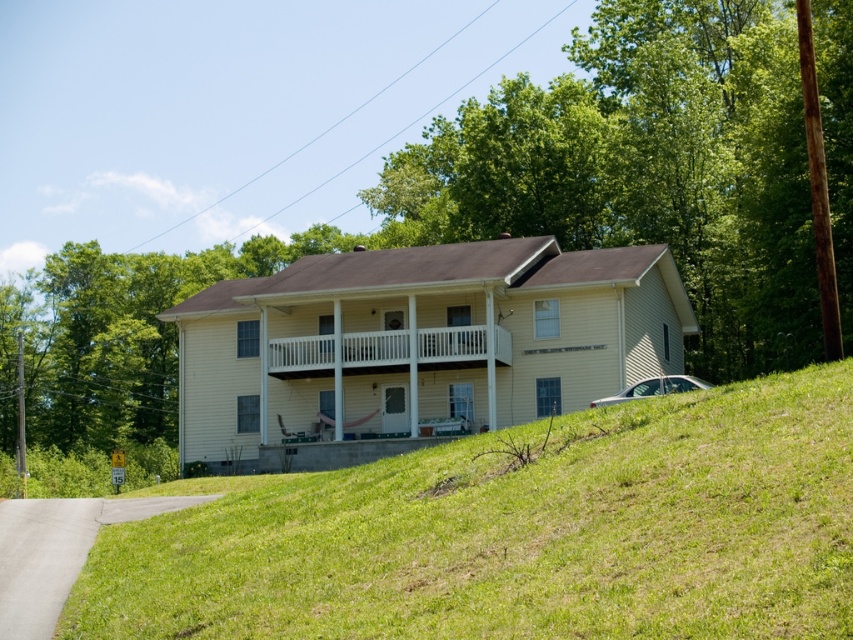
Is green grassy hillside at lower center wider than white wooden porch at center?

Correct, the width of green grassy hillside at lower center exceeds that of white wooden porch at center.

Is point (787, 577) closer to viewer compared to point (292, 356)?

Yes, it is in front of point (292, 356).

Locate an element on the screen. The height and width of the screenshot is (640, 853). green grassy hillside at lower center is located at coordinates (518, 532).